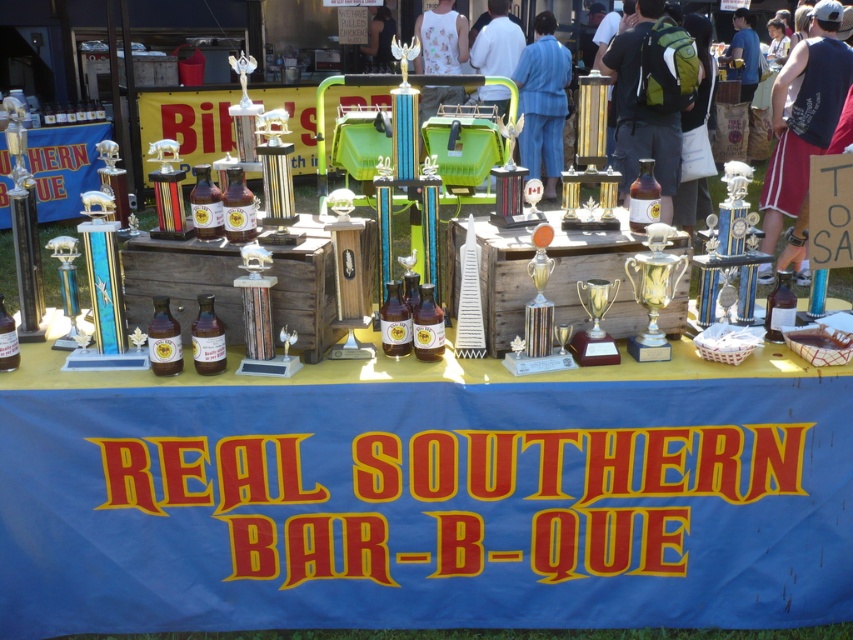
Question: Which point is closer to the camera?

Choices:
 (A) (489, 42)
 (B) (537, 48)
 (C) (743, 61)

Answer: (B)

Question: Can you confirm if blue cotton tank top at upper right is wider than white printed tank top at center?

Choices:
 (A) no
 (B) yes

Answer: (B)

Question: Based on their relative distances, which object is nearer to the white printed tank top at center?

Choices:
 (A) gold metallic trophy at center
 (B) green backpack at center
 (C) blue cotton tank top at upper right

Answer: (B)

Question: Can you confirm if gold metallic trophy at center is bigger than blue fabric banner at upper center?

Choices:
 (A) yes
 (B) no

Answer: (B)

Question: Which point is closer to the camera?

Choices:
 (A) wooden chest at center
 (B) blue fabric suit at center
 (C) white printed tank top at center
 (D) blue fabric banner at upper center

Answer: (A)

Question: Is blue cotton tank top at upper right positioned before white printed tank top at center?

Choices:
 (A) yes
 (B) no

Answer: (A)